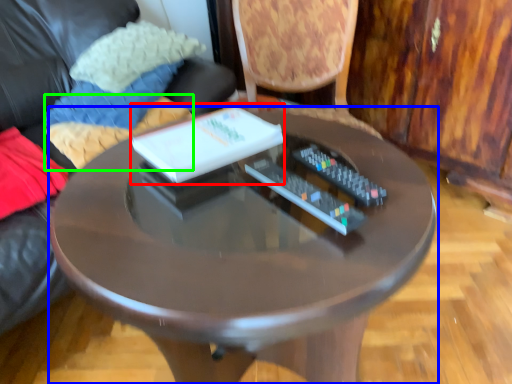
Question: Which is farther away from book (highlighted by a red box)? table (highlighted by a blue box) or pillow (highlighted by a green box)?

Choices:
 (A) table
 (B) pillow

Answer: (B)